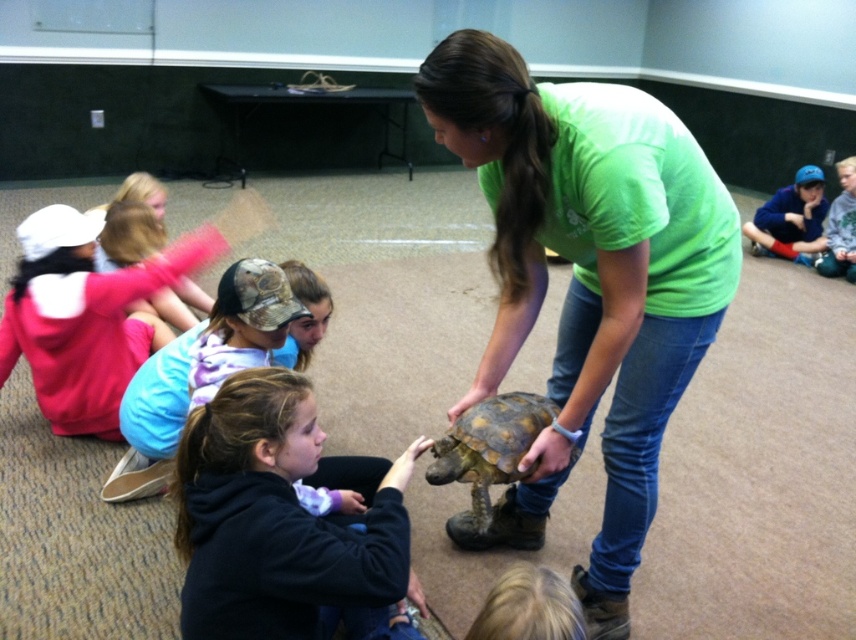
Which of these two, matte pink hoodie at lower left or blue fleece jacket at upper right, stands taller?

Standing taller between the two is matte pink hoodie at lower left.

What are the coordinates of `matte pink hoodie at lower left` in the screenshot? It's located at (88, 328).

Is point (236, 500) less distant than point (801, 227)?

That is True.

The image size is (856, 640). What do you see at coordinates (276, 518) in the screenshot?
I see `dark blue hoodie at lower center` at bounding box center [276, 518].

Who is more forward, [211,561] or [764,225]?

Positioned in front is point [211,561].

At what (x,y) coordinates should I click in order to perform the action: click on dark blue hoodie at lower center. Please return your answer as a coordinate pair (x, y). This screenshot has height=640, width=856. Looking at the image, I should click on (276, 518).

Is dark blue hoodie at lower center taller than yellowish-brown scaly tortoise at center?

Indeed, dark blue hoodie at lower center has a greater height compared to yellowish-brown scaly tortoise at center.

The height and width of the screenshot is (640, 856). Describe the element at coordinates (276, 518) in the screenshot. I see `dark blue hoodie at lower center` at that location.

Is point (387, 600) positioned behind point (492, 408)?

No, it is not.

Where is `dark blue hoodie at lower center`? dark blue hoodie at lower center is located at coordinates (276, 518).